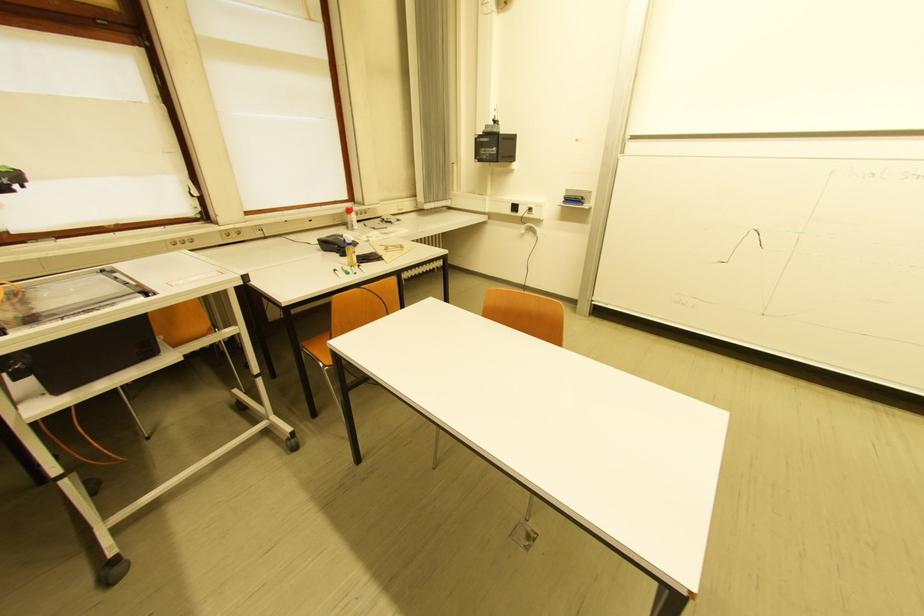
This screenshot has width=924, height=616. I want to click on small yellow bottle, so click(x=350, y=254).